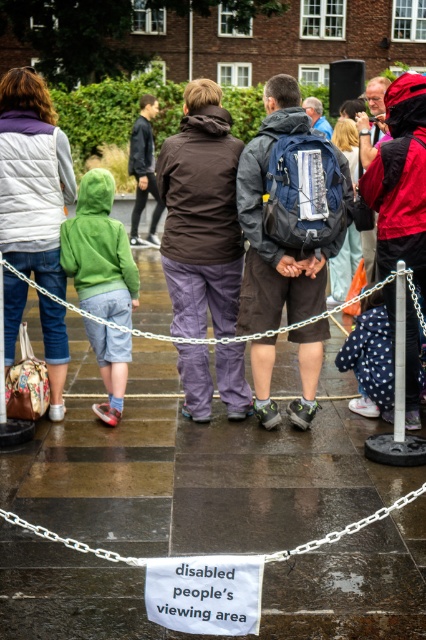
You are a photographer trying to capture a clear shot of the silver chain at center without the matte black backpack at center blocking it. Based on the scene, is this possible?

The silver chain at center is behind the matte black backpack at center, so it would be blocked by the backpack. You cannot capture a clear shot of the silver chain at center without the backpack blocking it.